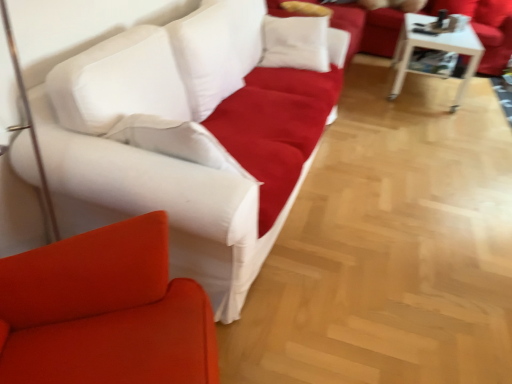
In order to click on free space in front of white glossy table at upper right in this screenshot , I will do `click(426, 119)`.